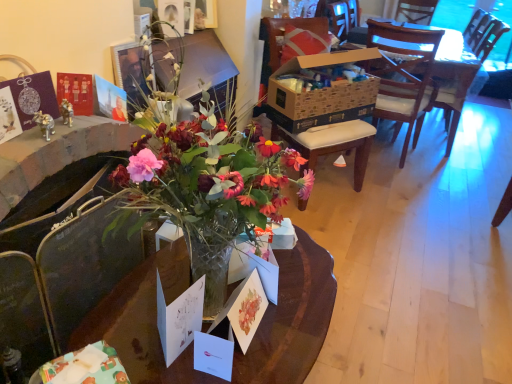
Locate an element on the screen. vacant space situated on the left part of white paper postcard at center, the 2th postcard in the right-to-left sequence is located at coordinates (153, 356).